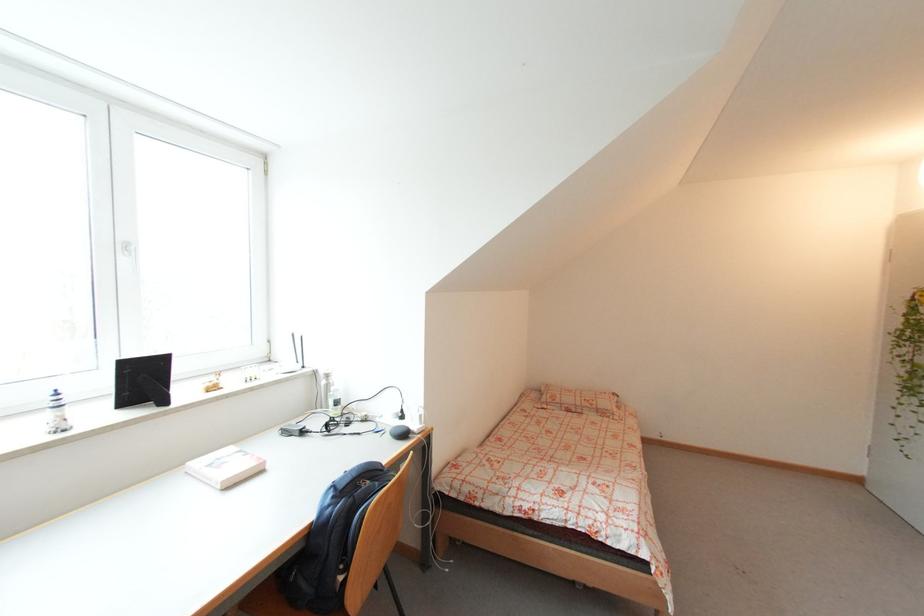
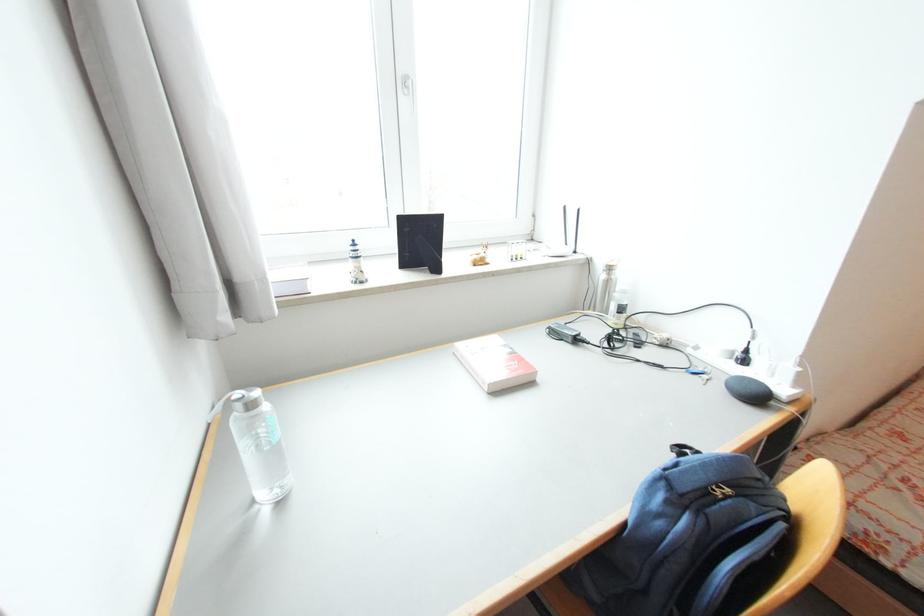
The images are taken continuously from a first-person perspective. In which direction is your viewpoint rotating?

The camera's rotation is toward left-down.